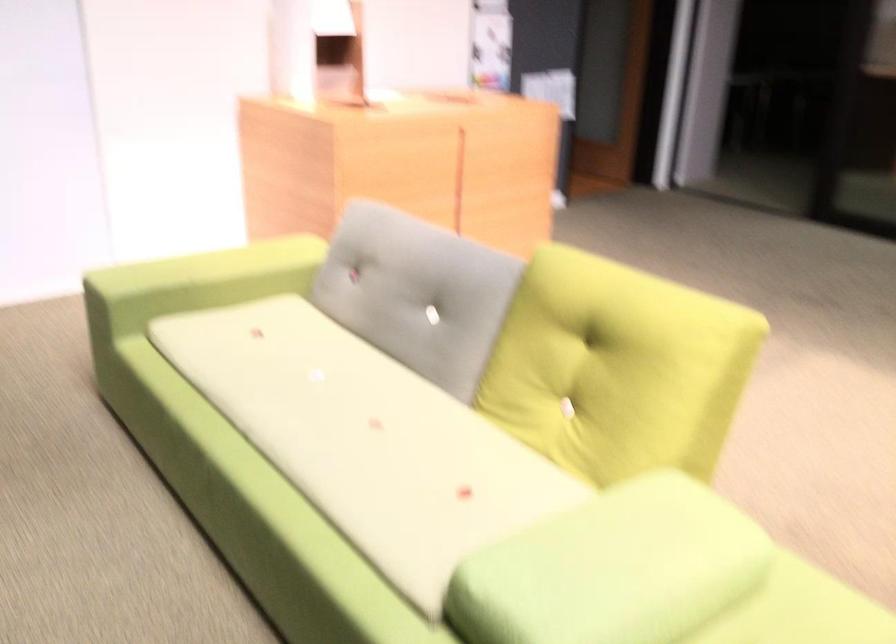
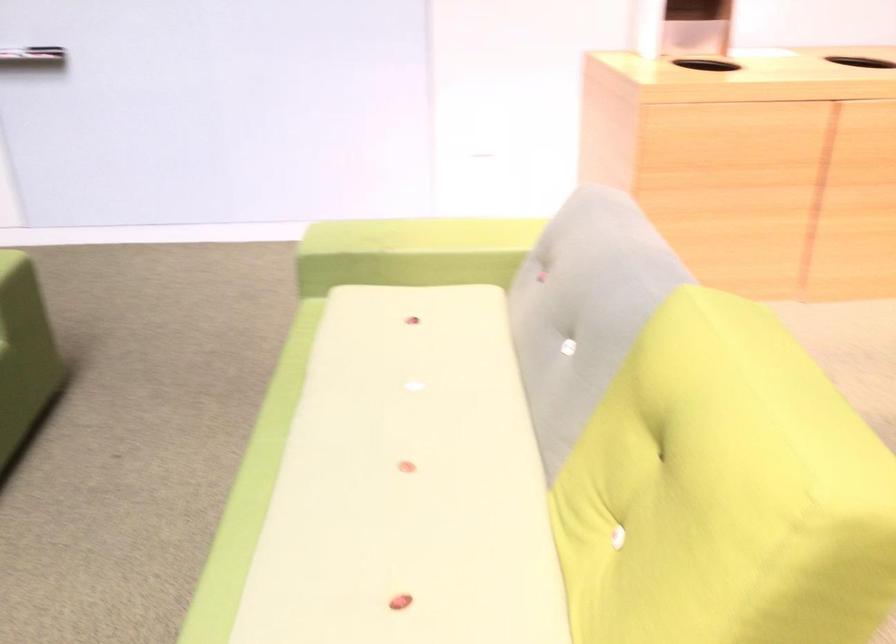
Question: The images are taken continuously from a first-person perspective. In which direction is your viewpoint rotating?

Choices:
 (A) Left
 (B) Right
 (C) Up
 (D) Down

Answer: (A)